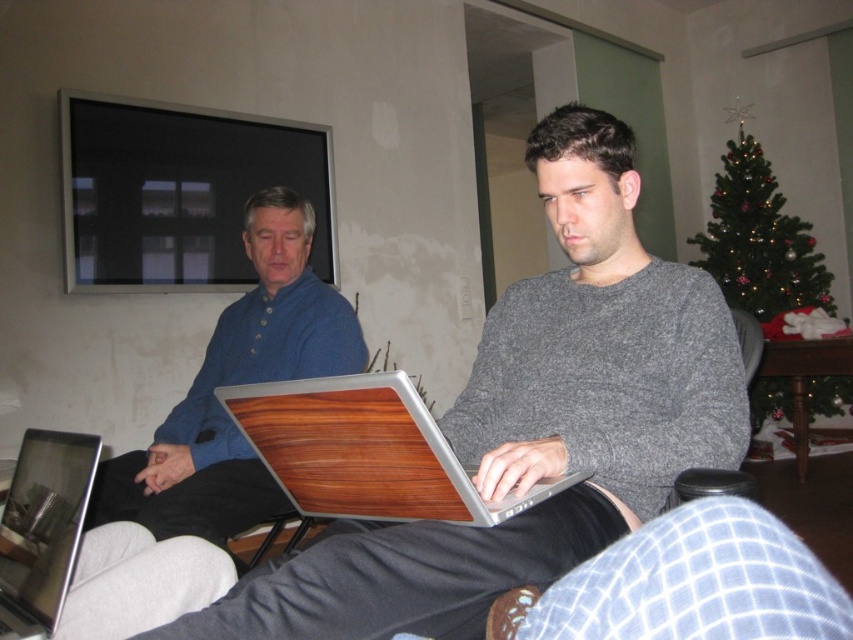
You are standing at the center of the room. You need to place a new plant pot exactly where the wooden laptop at lower left is located. What are the coordinates where you should place the plant pot?

The coordinates to place the plant pot are at point (42, 529), as that is where the wooden laptop at lower left is located.

You are organizing a holiday party and need to place decorations. The blue denim shirt at upper left and the green matte christmas tree at upper right are in the room. Which object should you move if you want to make space for a large gift box that requires more room than the smaller item?

You should move the blue denim shirt at upper left because it has a smaller size compared to the green matte christmas tree at upper right, making it easier to relocate to free up space.